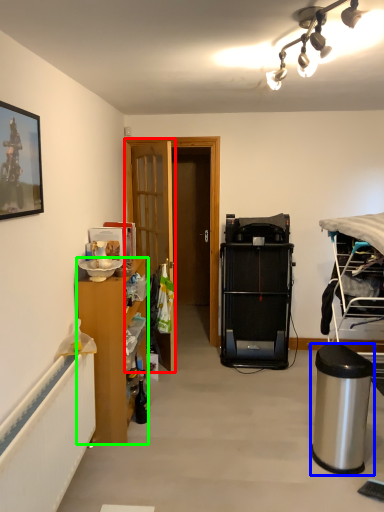
Question: Estimate the real-world distances between objects in this image. Which object is closer to door (highlighted by a red box), trash bin/can (highlighted by a blue box) or cabinetry (highlighted by a green box)?

Choices:
 (A) trash bin/can
 (B) cabinetry

Answer: (B)